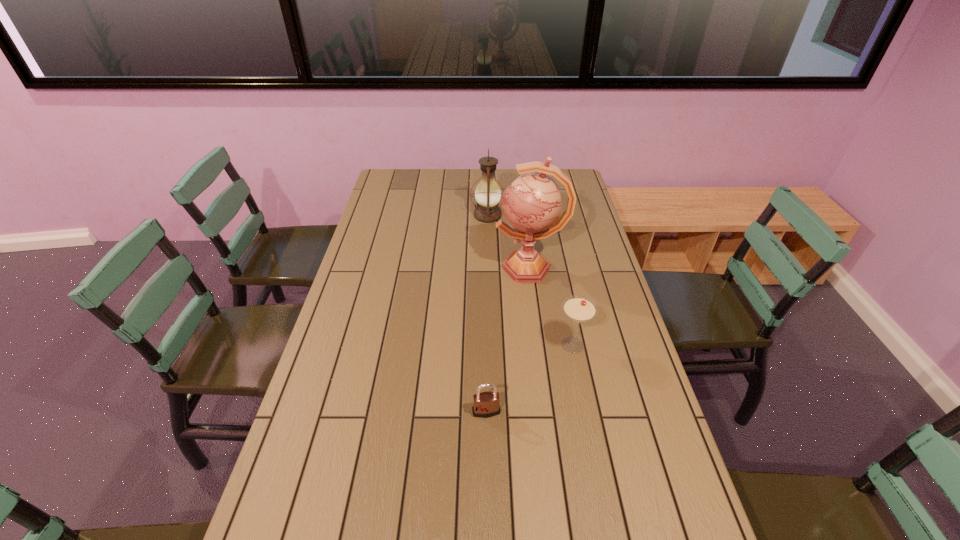
The image size is (960, 540). I want to click on the tallest object, so click(x=532, y=205).

At what (x,y) coordinates should I click in order to perform the action: click on globe. Please return your answer as a coordinate pair (x, y). The width and height of the screenshot is (960, 540). Looking at the image, I should click on (532, 205).

In order to click on oil lamp in this screenshot , I will do `click(487, 194)`.

The width and height of the screenshot is (960, 540). I want to click on the farthest object, so click(487, 194).

This screenshot has width=960, height=540. What are the coordinates of `the third tallest object` in the screenshot? It's located at (579, 309).

You are a GUI agent. You are given a task and a screenshot of the screen. Output one action in this format:
    pyautogui.click(x=<x>, y=<y>)
    Task: Click on the martini
    This screenshot has height=540, width=960.
    Given the screenshot: What is the action you would take?
    pyautogui.click(x=579, y=309)

Where is `the nearest object`? the nearest object is located at coordinates (486, 404).

You are a GUI agent. You are given a task and a screenshot of the screen. Output one action in this format:
    pyautogui.click(x=<x>, y=<y>)
    Task: Click on the shortest object
    
    Given the screenshot: What is the action you would take?
    pyautogui.click(x=486, y=404)

Locate an element on the screen. vacant space located on the front-facing side of the second farthest object is located at coordinates (385, 268).

I want to click on free space located on the front-facing side of the second farthest object, so click(x=402, y=268).